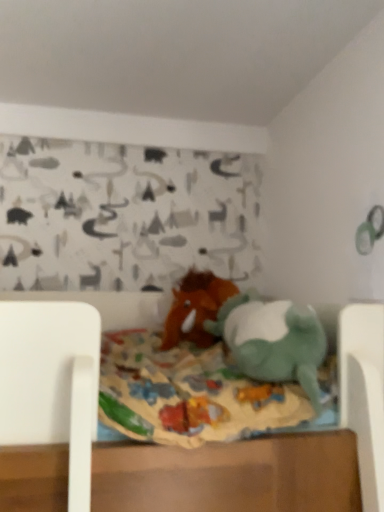
This screenshot has height=512, width=384. What do you see at coordinates (195, 308) in the screenshot? I see `brown plush horse at center, arranged as the second toy when viewed from the front` at bounding box center [195, 308].

Find the location of `brown plush horse at center, acting as the first toy starting from the back`. brown plush horse at center, acting as the first toy starting from the back is located at coordinates (195, 308).

This screenshot has width=384, height=512. I want to click on green plush toy at center, arranged as the 2th toy when viewed from the back, so click(273, 341).

The height and width of the screenshot is (512, 384). Describe the element at coordinates (273, 341) in the screenshot. I see `green plush toy at center, the 1th toy from the front` at that location.

Identify the location of brown plush horse at center, acting as the first toy starting from the back. (195, 308).

Which is more to the right, green plush toy at center, the 1th toy from the front, or brown plush horse at center, acting as the first toy starting from the back?

Positioned to the right is green plush toy at center, the 1th toy from the front.

Considering the relative positions of green plush toy at center, the 1th toy from the front, and brown plush horse at center, acting as the first toy starting from the back, in the image provided, is green plush toy at center, the 1th toy from the front, behind brown plush horse at center, acting as the first toy starting from the back,?

No, the depth of green plush toy at center, the 1th toy from the front, is less than that of brown plush horse at center, acting as the first toy starting from the back.

Considering the points (243, 314) and (219, 296), which point is behind, point (243, 314) or point (219, 296)?

The point (219, 296) is farther from the camera.

From the image's perspective, between green plush toy at center, the 1th toy from the front, and brown plush horse at center, arranged as the second toy when viewed from the front, which one is located above?

brown plush horse at center, arranged as the second toy when viewed from the front, appears higher in the image.

From a real-world perspective, is green plush toy at center, arranged as the 2th toy when viewed from the back, on top of brown plush horse at center, arranged as the second toy when viewed from the front?

No.

Which object is wider, green plush toy at center, the 1th toy from the front, or brown plush horse at center, arranged as the second toy when viewed from the front?

With larger width is brown plush horse at center, arranged as the second toy when viewed from the front.

Between green plush toy at center, the 1th toy from the front, and brown plush horse at center, acting as the first toy starting from the back, which one has more height?

With more height is brown plush horse at center, acting as the first toy starting from the back.

Considering the sizes of objects green plush toy at center, the 1th toy from the front, and brown plush horse at center, acting as the first toy starting from the back, in the image provided, who is bigger, green plush toy at center, the 1th toy from the front, or brown plush horse at center, acting as the first toy starting from the back,?

green plush toy at center, the 1th toy from the front.

Do you think green plush toy at center, arranged as the 2th toy when viewed from the back, is within brown plush horse at center, arranged as the second toy when viewed from the front, or outside of it?

The correct answer is: outside.

Is green plush toy at center, the 1th toy from the front, placed right next to brown plush horse at center, arranged as the second toy when viewed from the front?

No, green plush toy at center, the 1th toy from the front, is not making contact with brown plush horse at center, arranged as the second toy when viewed from the front.

Does green plush toy at center, the 1th toy from the front, turn towards brown plush horse at center, acting as the first toy starting from the back?

No, green plush toy at center, the 1th toy from the front, does not turn towards brown plush horse at center, acting as the first toy starting from the back.

Consider the image. How different are the orientations of green plush toy at center, arranged as the 2th toy when viewed from the back, and brown plush horse at center, acting as the first toy starting from the back, in degrees?

They differ by 94.6 degrees in their facing directions.

How distant is green plush toy at center, the 1th toy from the front, from brown plush horse at center, acting as the first toy starting from the back?

9.76 inches.

Locate an element on the screen. The height and width of the screenshot is (512, 384). toy on the right of brown plush horse at center, arranged as the second toy when viewed from the front is located at coordinates (273, 341).

Can you confirm if brown plush horse at center, arranged as the second toy when viewed from the front, is positioned to the right of green plush toy at center, arranged as the 2th toy when viewed from the back?

In fact, brown plush horse at center, arranged as the second toy when viewed from the front, is to the left of green plush toy at center, arranged as the 2th toy when viewed from the back.

Is brown plush horse at center, acting as the first toy starting from the back, closer to the viewer compared to green plush toy at center, arranged as the 2th toy when viewed from the back?

No, brown plush horse at center, acting as the first toy starting from the back, is behind green plush toy at center, arranged as the 2th toy when viewed from the back.

Is point (180, 327) positioned before point (260, 375)?

No, (180, 327) is further to viewer.

From the image's perspective, is brown plush horse at center, arranged as the second toy when viewed from the front, beneath green plush toy at center, arranged as the 2th toy when viewed from the back?

No, from the image's perspective, brown plush horse at center, arranged as the second toy when viewed from the front, is not below green plush toy at center, arranged as the 2th toy when viewed from the back.

From a real-world perspective, who is located lower, brown plush horse at center, acting as the first toy starting from the back, or green plush toy at center, arranged as the 2th toy when viewed from the back?

green plush toy at center, arranged as the 2th toy when viewed from the back.

In terms of width, does brown plush horse at center, arranged as the second toy when viewed from the front, look wider or thinner when compared to green plush toy at center, the 1th toy from the front?

brown plush horse at center, arranged as the second toy when viewed from the front, is wider than green plush toy at center, the 1th toy from the front.

From the picture: Between brown plush horse at center, arranged as the second toy when viewed from the front, and green plush toy at center, arranged as the 2th toy when viewed from the back, which one has less height?

Standing shorter between the two is green plush toy at center, arranged as the 2th toy when viewed from the back.

Who is bigger, brown plush horse at center, acting as the first toy starting from the back, or green plush toy at center, the 1th toy from the front?

Bigger between the two is green plush toy at center, the 1th toy from the front.

Do you think brown plush horse at center, arranged as the second toy when viewed from the front, is within green plush toy at center, the 1th toy from the front, or outside of it?

brown plush horse at center, arranged as the second toy when viewed from the front, exists outside the volume of green plush toy at center, the 1th toy from the front.

Is brown plush horse at center, arranged as the second toy when viewed from the front, placed right next to green plush toy at center, arranged as the 2th toy when viewed from the back?

No, brown plush horse at center, arranged as the second toy when viewed from the front, is not making contact with green plush toy at center, arranged as the 2th toy when viewed from the back.

Does brown plush horse at center, acting as the first toy starting from the back, turn towards green plush toy at center, the 1th toy from the front?

Yes, brown plush horse at center, acting as the first toy starting from the back, faces towards green plush toy at center, the 1th toy from the front.

Can you tell me how much brown plush horse at center, acting as the first toy starting from the back, and green plush toy at center, arranged as the 2th toy when viewed from the back, differ in facing direction?

The angular difference between brown plush horse at center, acting as the first toy starting from the back, and green plush toy at center, arranged as the 2th toy when viewed from the back, is 94.6 degrees.

Measure the distance from brown plush horse at center, arranged as the second toy when viewed from the front, to green plush toy at center, arranged as the 2th toy when viewed from the back.

9.76 inches.

Find the location of `toy to the right of brown plush horse at center, acting as the first toy starting from the back`. toy to the right of brown plush horse at center, acting as the first toy starting from the back is located at coordinates (273, 341).

In the image, there is a brown plush horse at center, arranged as the second toy when viewed from the front. Identify the location of toy below it (from the image's perspective). The image size is (384, 512). (273, 341).

You are a GUI agent. You are given a task and a screenshot of the screen. Output one action in this format:
    pyautogui.click(x=<x>, y=<y>)
    Task: Click on the toy on the right of the brown plush horse at center, acting as the first toy starting from the back
    
    Given the screenshot: What is the action you would take?
    pyautogui.click(x=273, y=341)